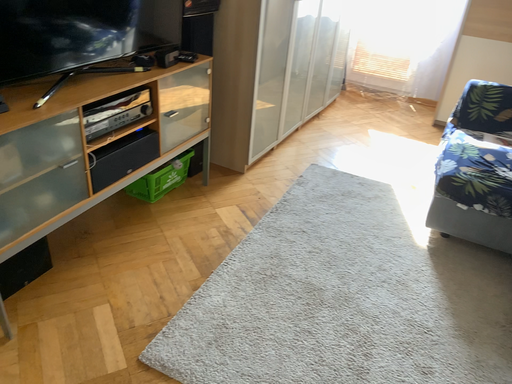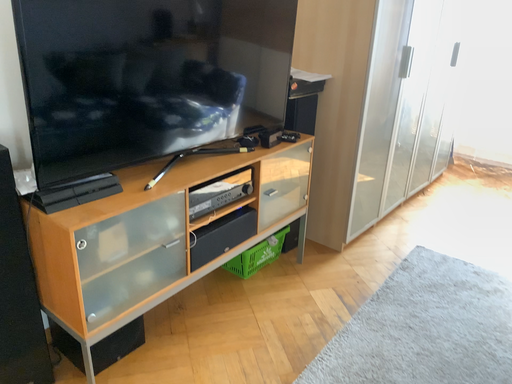
Question: How did the camera likely rotate when shooting the video?

Choices:
 (A) rotated right
 (B) rotated left

Answer: (B)